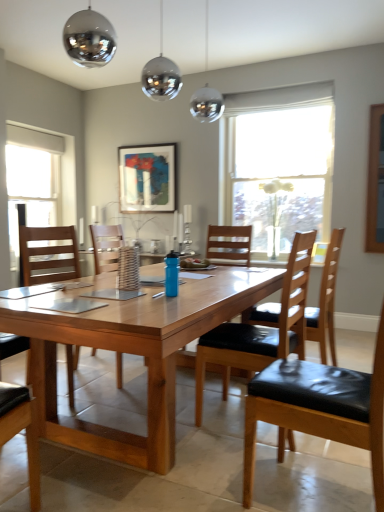
Question: Is matte black picture frame at upper center bigger than white glass window at left, which ranks as the second window in right-to-left order?

Choices:
 (A) no
 (B) yes

Answer: (A)

Question: Is white glass window at left, which ranks as the second window in right-to-left order, at the back of matte black picture frame at upper center?

Choices:
 (A) yes
 (B) no

Answer: (B)

Question: From the image's perspective, does matte black picture frame at upper center appear lower than white glass window at left, the 1th window when ordered from left to right?

Choices:
 (A) yes
 (B) no

Answer: (B)

Question: Considering the relative sizes of matte black picture frame at upper center and white glass window at left, which ranks as the second window in right-to-left order, in the image provided, is matte black picture frame at upper center shorter than white glass window at left, which ranks as the second window in right-to-left order,?

Choices:
 (A) no
 (B) yes

Answer: (B)

Question: Does matte black picture frame at upper center lie in front of white glass window at left, the 1th window when ordered from left to right?

Choices:
 (A) yes
 (B) no

Answer: (B)

Question: Can you confirm if matte black picture frame at upper center is thinner than white glass window at left, the 1th window when ordered from left to right?

Choices:
 (A) no
 (B) yes

Answer: (B)

Question: From a real-world perspective, does black leather chair at center, which ranks as the second chair in left-to-right order, sit lower than black leather chair at right, marked as the fourth chair in a left-to-right arrangement?

Choices:
 (A) no
 (B) yes

Answer: (B)

Question: Can you confirm if black leather chair at center, arranged as the 3th chair when viewed from the right, is smaller than black leather chair at right, marked as the fourth chair in a left-to-right arrangement?

Choices:
 (A) no
 (B) yes

Answer: (B)

Question: Is black leather chair at center, arranged as the 3th chair when viewed from the right, not close to black leather chair at right, marked as the fourth chair in a left-to-right arrangement?

Choices:
 (A) no
 (B) yes

Answer: (B)

Question: Is black leather chair at center, arranged as the 3th chair when viewed from the right, at the left side of black leather chair at right, marked as the fourth chair in a left-to-right arrangement?

Choices:
 (A) yes
 (B) no

Answer: (A)

Question: Is the position of black leather chair at center, which ranks as the second chair in left-to-right order, more distant than that of black leather chair at right, marked as the fourth chair in a left-to-right arrangement?

Choices:
 (A) yes
 (B) no

Answer: (B)

Question: Does black leather chair at center, arranged as the 3th chair when viewed from the right, have a lesser height compared to black leather chair at right, marked as the fourth chair in a left-to-right arrangement?

Choices:
 (A) yes
 (B) no

Answer: (A)

Question: Does woven brown basket at center touch white glass window at left, the 1th window when ordered from left to right?

Choices:
 (A) yes
 (B) no

Answer: (B)